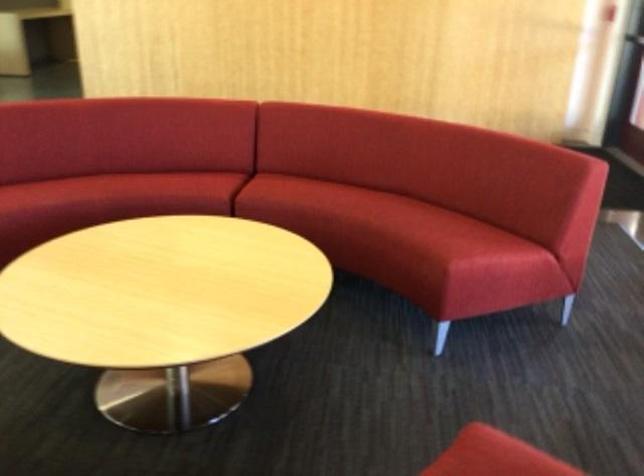
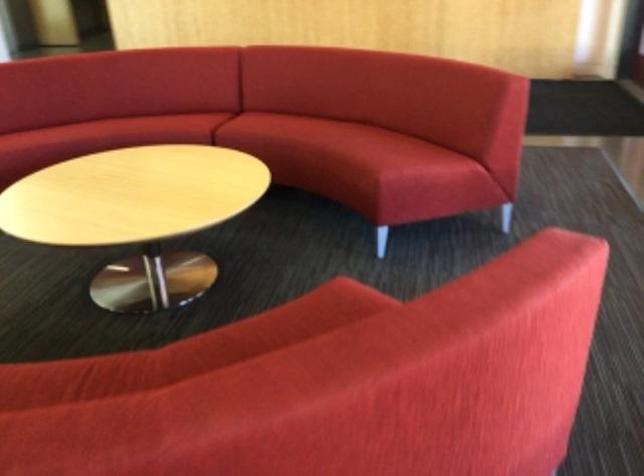
Question: The camera is either moving clockwise (left) or counter-clockwise (right) around the object. The first image is from the beginning of the video and the second image is from the end. Is the camera moving left or right when shooting the video?

Choices:
 (A) Left
 (B) Right

Answer: (B)